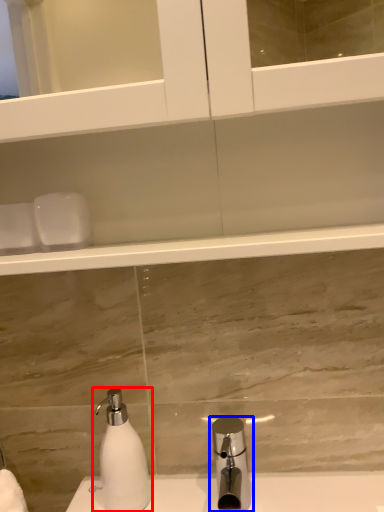
Question: Which point is closer to the camera, soap dispenser (highlighted by a red box) or tap (highlighted by a blue box)?

Choices:
 (A) soap dispenser
 (B) tap

Answer: (B)